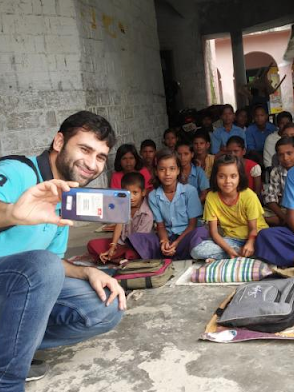
Where is `cement floorconcrete block wall`? cement floorconcrete block wall is located at coordinates (161, 357), (100, 92).